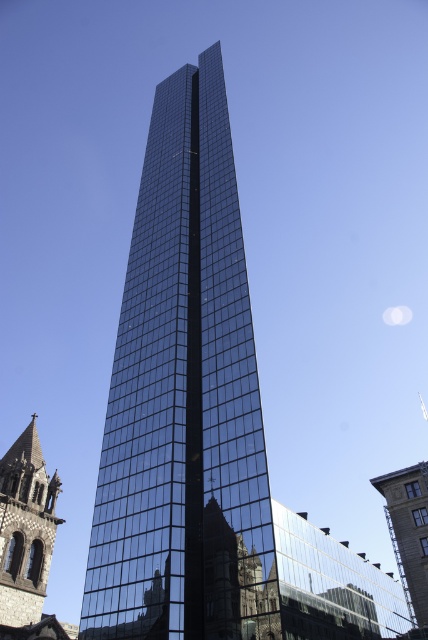
You are standing at the point labeled point (184, 401). What object are you facing?

The point labeled point (184, 401) indicates the glossy glass tower at center, so you are facing the glossy glass tower at center.

You are standing in front of the modern skyscraper and looking towards the historic church. There are two points marked in the scene. The first point is at coordinates point (41, 460) and the second point is at point (410, 556). Which of these two points is closer to you?

Point (41, 460) is closer to you because it is further to the camera than point (410, 556).

You are an architect evaluating the spatial compatibility of the dark brown stone church steeple at lower left and the glassy reflective building at center. Based on their sizes, which one would require more structural support to maintain stability?

The dark brown stone church steeple at lower left requires more structural support because it is bigger than the glassy reflective building at center, and larger structures typically need stronger foundations and support systems to ensure stability.